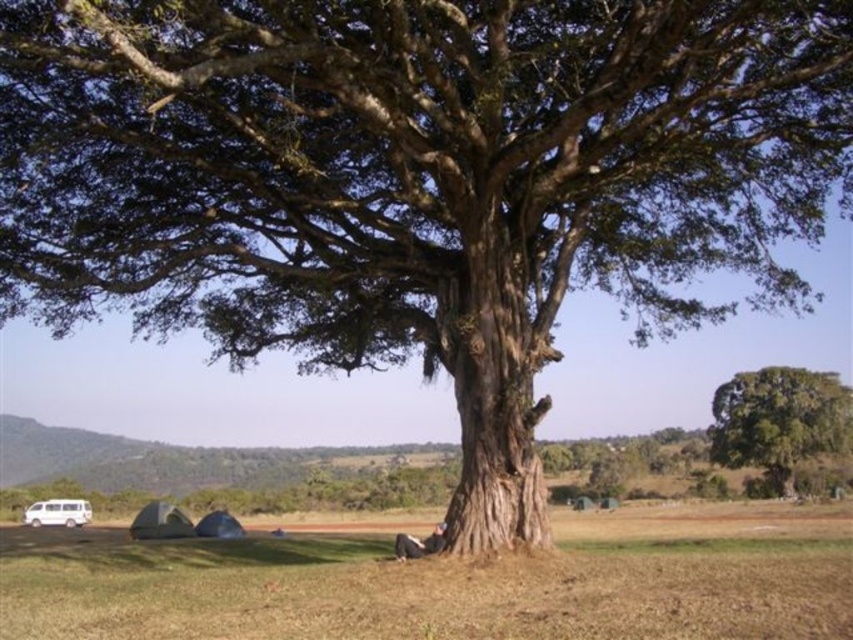
Does brown grass at lower center have a greater width compared to white matte van at lower left?

Yes.

Describe the element at coordinates (444, 579) in the screenshot. The height and width of the screenshot is (640, 853). I see `brown grass at lower center` at that location.

In the scene shown: Who is more forward, [538,561] or [68,518]?

Point [538,561]

You are a GUI agent. You are given a task and a screenshot of the screen. Output one action in this format:
    pyautogui.click(x=<x>, y=<y>)
    Task: Click on the brown grass at lower center
    Image resolution: width=853 pixels, height=640 pixels.
    Given the screenshot: What is the action you would take?
    pyautogui.click(x=444, y=579)

The width and height of the screenshot is (853, 640). What do you see at coordinates (779, 420) in the screenshot? I see `green rough bark tree at upper right` at bounding box center [779, 420].

Who is shorter, green rough bark tree at upper right or white matte van at lower left?

green rough bark tree at upper right is shorter.

Between point (753, 390) and point (56, 500), which one is positioned in front?

Point (56, 500)

Identify the location of green rough bark tree at upper right. This screenshot has width=853, height=640. (779, 420).

Is point (798, 516) behind point (807, 387)?

No, it is in front of (807, 387).

Is point (96, 570) positioned before point (769, 428)?

Yes, it is.

What do you see at coordinates (444, 579) in the screenshot?
I see `brown grass at lower center` at bounding box center [444, 579].

At what (x,y) coordinates should I click in order to perform the action: click on brown grass at lower center. Please return your answer as a coordinate pair (x, y). Looking at the image, I should click on (444, 579).